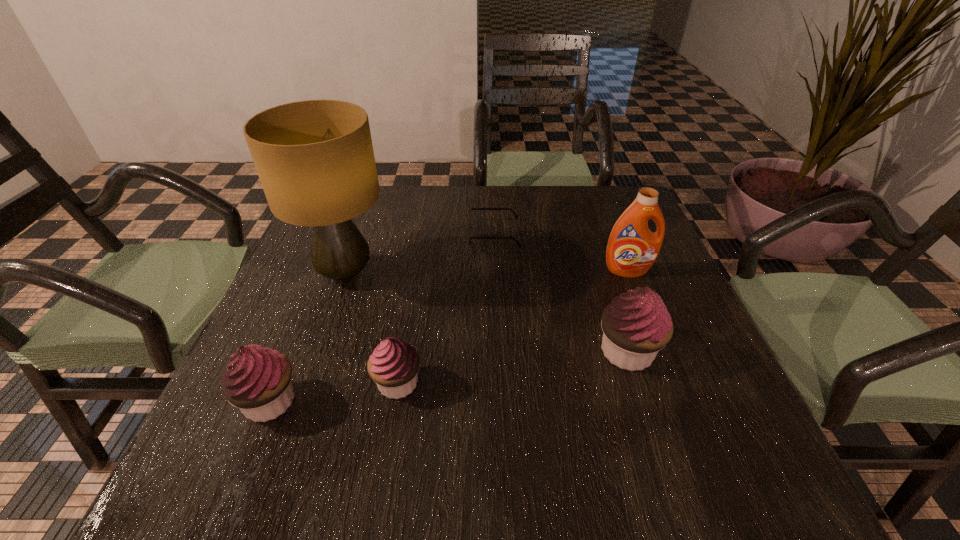
If the aim is uniform spacing by inserting an additional cupcake among them, please point to a vacant space for this new cupcake. Please provide its 2D coordinates. Your answer should be formatted as a tuple, i.e. [(x, y)], where the tuple contains the x and y coordinates of a point satisfying the conditions above.

[(516, 367)]